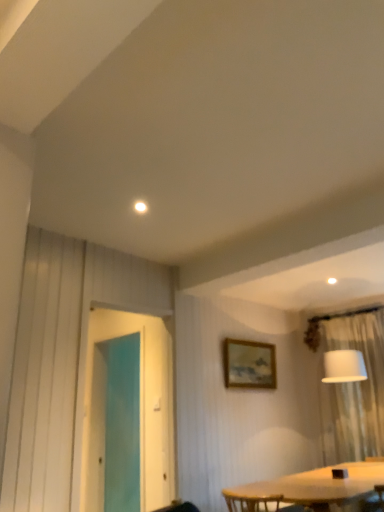
Question: From the image's perspective, would you say transparent glass screen door at left is positioned over wooden frame at upper center?

Choices:
 (A) no
 (B) yes

Answer: (B)

Question: Is transparent glass screen door at left bigger than wooden frame at upper center?

Choices:
 (A) no
 (B) yes

Answer: (B)

Question: Is transparent glass screen door at left turned away from wooden frame at upper center?

Choices:
 (A) yes
 (B) no

Answer: (B)

Question: Would you consider transparent glass screen door at left to be distant from wooden frame at upper center?

Choices:
 (A) no
 (B) yes

Answer: (B)

Question: Can we say transparent glass screen door at left lies outside wooden frame at upper center?

Choices:
 (A) no
 (B) yes

Answer: (B)

Question: In terms of width, does wooden frame at upper center look wider or thinner when compared to white sheer curtain at right?

Choices:
 (A) wide
 (B) thin

Answer: (B)

Question: From a real-world perspective, relative to white sheer curtain at right, is wooden frame at upper center vertically above or below?

Choices:
 (A) below
 (B) above

Answer: (B)

Question: Is wooden frame at upper center bigger or smaller than white sheer curtain at right?

Choices:
 (A) big
 (B) small

Answer: (B)

Question: Is point (266, 381) positioned closer to the camera than point (362, 324)?

Choices:
 (A) closer
 (B) farther

Answer: (A)

Question: Considering the positions of point (162, 388) and point (233, 369), is point (162, 388) closer or farther from the camera than point (233, 369)?

Choices:
 (A) closer
 (B) farther

Answer: (A)

Question: Would you say transparent glass screen door at left is inside or outside wooden frame at upper center?

Choices:
 (A) inside
 (B) outside

Answer: (B)

Question: Would you say transparent glass screen door at left is to the left or to the right of wooden frame at upper center in the picture?

Choices:
 (A) right
 (B) left

Answer: (B)

Question: From a real-world perspective, is transparent glass screen door at left physically located above or below wooden frame at upper center?

Choices:
 (A) below
 (B) above

Answer: (A)

Question: From a real-world perspective, is white sheer curtain at right positioned above or below wooden frame at upper center?

Choices:
 (A) below
 (B) above

Answer: (A)

Question: Is white sheer curtain at right taller or shorter than wooden frame at upper center?

Choices:
 (A) short
 (B) tall

Answer: (B)